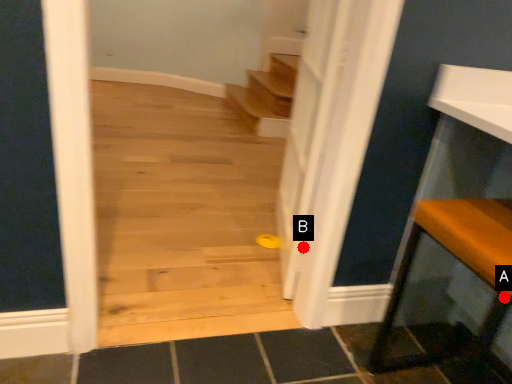
Question: Two points are circled on the image, labeled by A and B beside each circle. Which point appears closest to the camera in this image?

Choices:
 (A) A is closer
 (B) B is closer

Answer: (A)